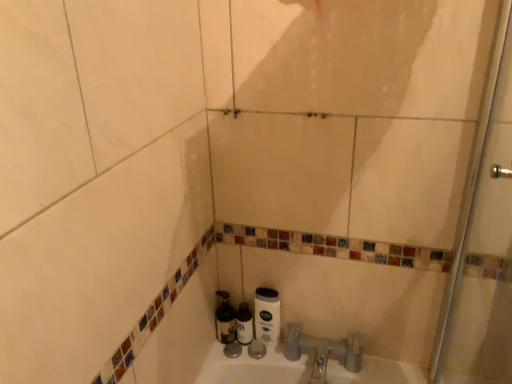
Question: Based on their positions, is translucent plastic bottle at center, the first bottle positioned from the right, located to the left or right of metallic silver bottle at lower center, which ranks as the 1th bottle in left-to-right order?

Choices:
 (A) right
 (B) left

Answer: (A)

Question: Is point (243, 307) positioned closer to the camera than point (228, 329)?

Choices:
 (A) closer
 (B) farther

Answer: (B)

Question: Considering the real-world distances, which object is farthest from the metallic silver bottle at lower center, which ranks as the 1th bottle in left-to-right order?

Choices:
 (A) white matte toilet paper at lower center
 (B) translucent plastic bottle at center, the 2th bottle positioned from the left
 (C) transparent glass shower door at right

Answer: (C)

Question: Considering the real-world distances, which object is farthest from the white matte toilet paper at lower center?

Choices:
 (A) translucent plastic bottle at center, the first bottle positioned from the right
 (B) transparent glass shower door at right
 (C) metallic silver bottle at lower center, which ranks as the 1th bottle in left-to-right order

Answer: (B)